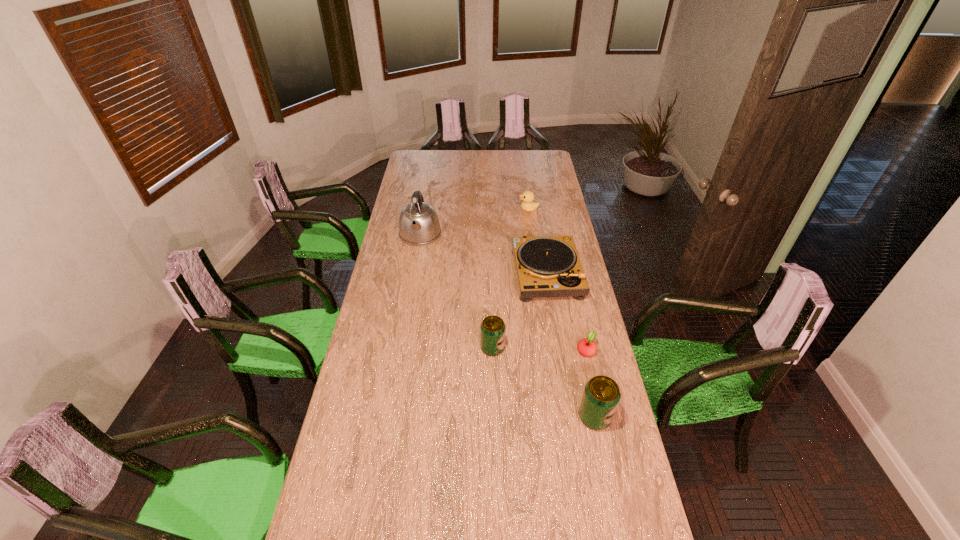
Locate an element on the screen. The height and width of the screenshot is (540, 960). free space located 0.330m on the left of the nearest object is located at coordinates (479, 417).

Locate an element on the screen. This screenshot has width=960, height=540. free space located 0.130m on the left of the record player is located at coordinates (484, 273).

Locate an element on the screen. This screenshot has width=960, height=540. blank space located 0.310m on the face of the farthest object is located at coordinates (461, 210).

Find the location of a particular element. free space located 0.270m on the face of the farthest object is located at coordinates (468, 210).

I want to click on vacant area situated 0.370m on the face of the farthest object, so click(x=450, y=210).

The image size is (960, 540). What are the coordinates of `vacant space situated 0.280m on the spout of the tallest object` in the screenshot? It's located at (410, 292).

Image resolution: width=960 pixels, height=540 pixels. What are the coordinates of `vacant space located on the back of the shortest object` in the screenshot? It's located at (570, 284).

You are a GUI agent. You are given a task and a screenshot of the screen. Output one action in this format:
    pyautogui.click(x=<x>, y=<y>)
    Task: Click on the object that is at the left edge
    
    Given the screenshot: What is the action you would take?
    pyautogui.click(x=419, y=224)

I want to click on beer can that is at the right edge, so click(601, 396).

Where is `record player located at the right edge`? record player located at the right edge is located at coordinates (546, 266).